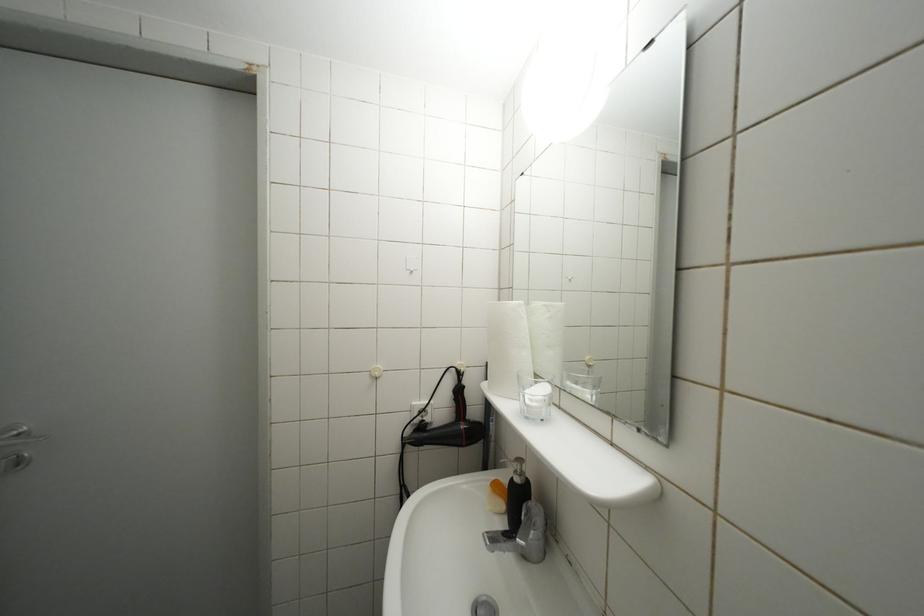
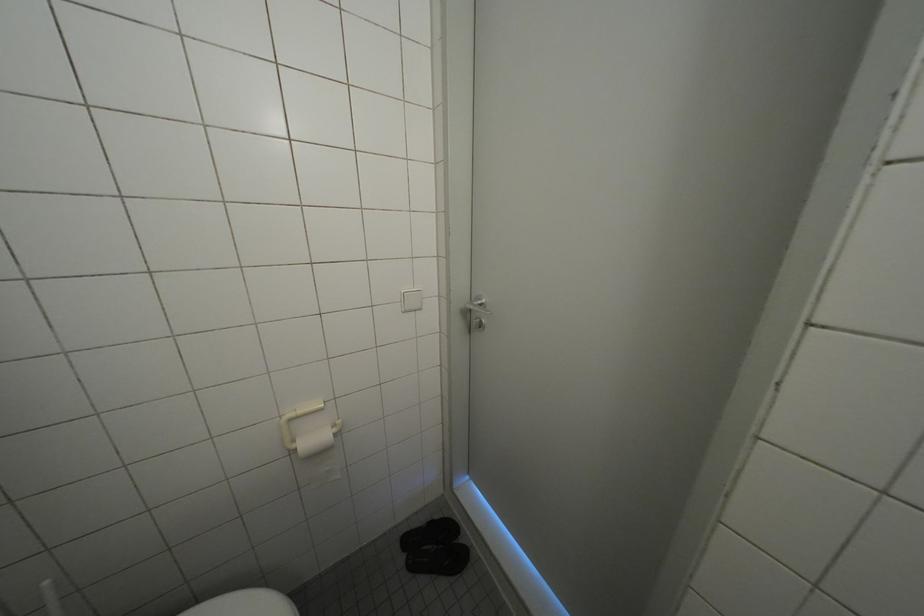
The first image is from the beginning of the video and the second image is from the end. How did the camera likely rotate when shooting the video?

The rotation direction of the camera is left-down.